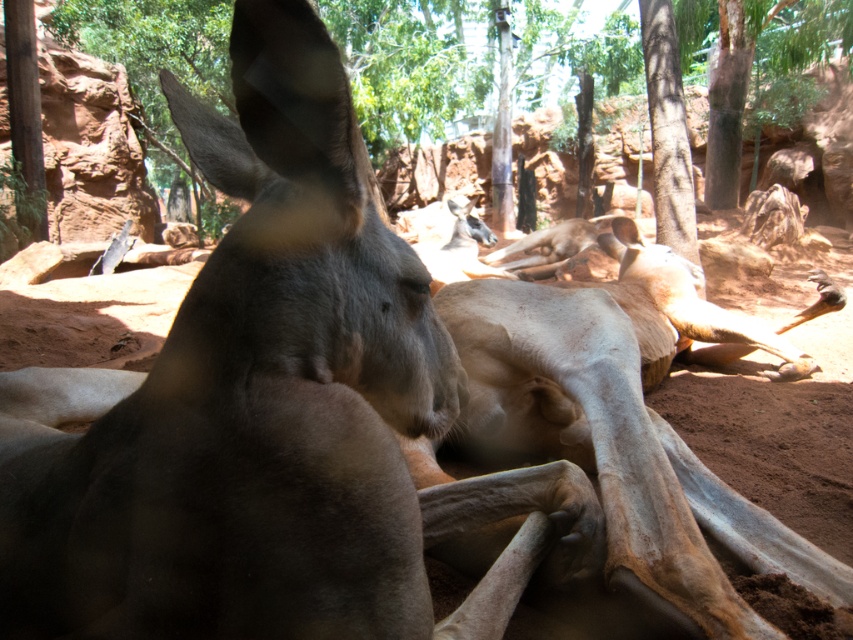
You are a zookeeper standing at the entrance of the enclosure. You need to approach the brown fur kangaroo at center to check its health. The safe distance to maintain is at least 30 inches away from the kangaroo. Is the current distance sufficient?

The brown fur kangaroo at center is 25.70 inches from the camera, which is less than the required 30 inches safe distance. Therefore, the current distance is not sufficient, and you should move back to ensure safety.

You are a zookeeper observing the kangaroo enclosure. You need to determine if the brown fur kangaroo at center can fit under the brown rough tree at upper center. What do you think?

The brown fur kangaroo at center has a smaller size compared to the brown rough tree at upper center, so it should be able to fit under the tree.